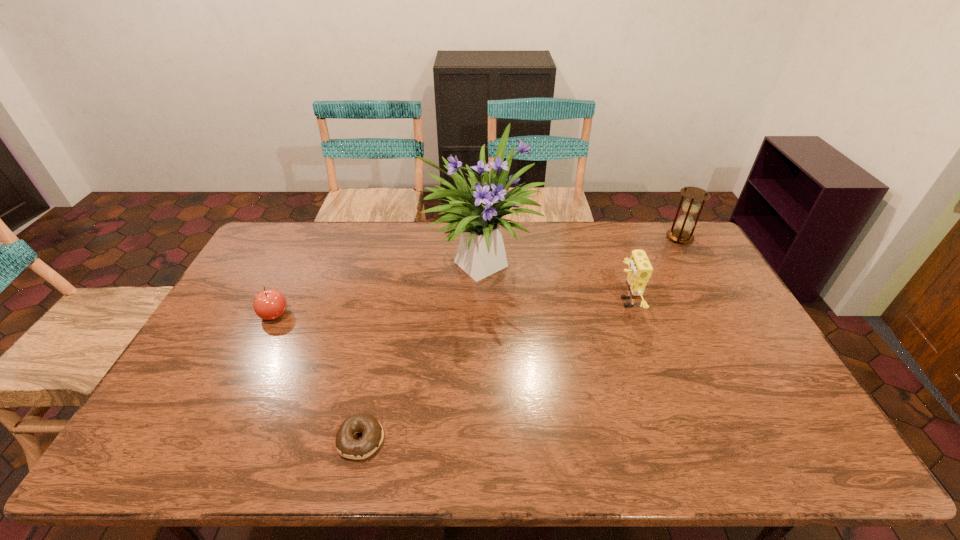
Identify the location of free region located on the face of the fourth object from left to right. (517, 302).

The height and width of the screenshot is (540, 960). In order to click on free space located on the face of the fourth object from left to right in this screenshot , I will do `click(530, 302)`.

Locate an element on the screen. This screenshot has width=960, height=540. vacant space located on the face of the fourth object from left to right is located at coordinates (505, 302).

At what (x,y) coordinates should I click in order to perform the action: click on vacant region located on the right of the apple. Please return your answer as a coordinate pair (x, y). Image resolution: width=960 pixels, height=540 pixels. Looking at the image, I should click on (396, 314).

Where is `free space located 0.230m on the back of the doughnut`? The width and height of the screenshot is (960, 540). free space located 0.230m on the back of the doughnut is located at coordinates (381, 347).

Where is `flower arrangement positioned at the far edge`? This screenshot has width=960, height=540. flower arrangement positioned at the far edge is located at coordinates (476, 213).

Identify the location of hourglass positioned at the far edge. (685, 223).

The image size is (960, 540). In order to click on object that is positioned at the near edge in this screenshot , I will do `click(347, 446)`.

The height and width of the screenshot is (540, 960). In order to click on object located at the left edge in this screenshot , I will do `click(270, 304)`.

Identify the location of object that is positioned at the right edge. (685, 223).